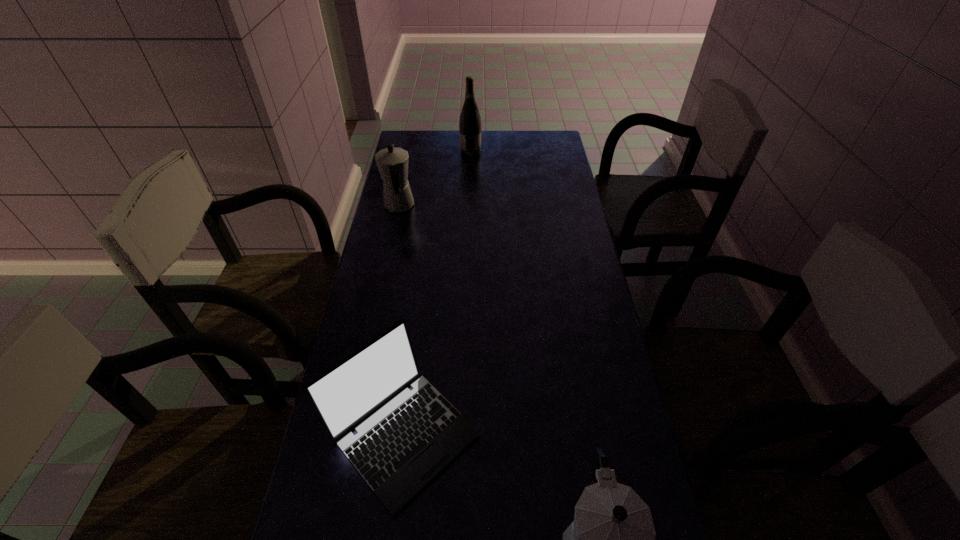
The width and height of the screenshot is (960, 540). I want to click on free point at the far edge, so click(517, 155).

Locate an element on the screen. vacant region at the left edge of the desktop is located at coordinates (393, 246).

Image resolution: width=960 pixels, height=540 pixels. Identify the location of vacant area at the right edge of the desktop. (578, 316).

At what (x,y) coordinates should I click in order to perform the action: click on vacant space at the far left corner. Please return your answer as a coordinate pair (x, y). The image size is (960, 540). Looking at the image, I should click on (432, 143).

In order to click on free spot at the far right corner of the desktop in this screenshot , I will do point(529,145).

I want to click on vacant space that is in between the farther coffeepot and the tallest object, so [435, 179].

Image resolution: width=960 pixels, height=540 pixels. Identify the location of vacant region between the shortest object and the farthest object. [x=437, y=292].

Locate an element on the screen. The width and height of the screenshot is (960, 540). free spot between the farther coffeepot and the farthest object is located at coordinates (435, 179).

At what (x,y) coordinates should I click in order to perform the action: click on vacant space that's between the wine bottle and the left coffeepot. Please return your answer as a coordinate pair (x, y). This screenshot has height=540, width=960. Looking at the image, I should click on (435, 179).

The width and height of the screenshot is (960, 540). What are the coordinates of `object that is the third closest to the rightmost object` in the screenshot? It's located at (470, 122).